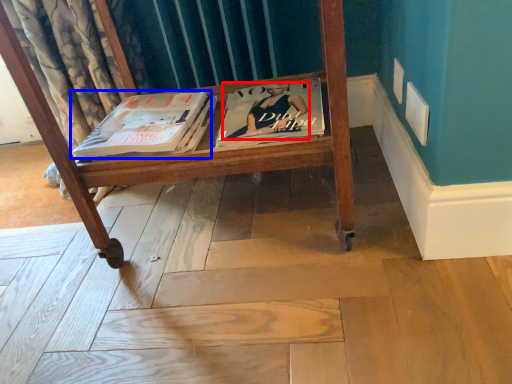
Question: Which object is further to the camera taking this photo, person (highlighted by a red box) or book (highlighted by a blue box)?

Choices:
 (A) person
 (B) book

Answer: (B)